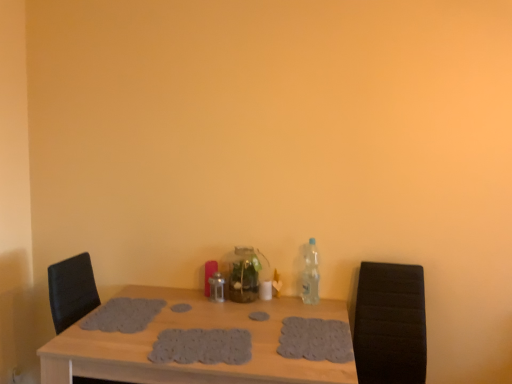
Question: Considering the relative positions of clear glass vase at center, the 1th bottle when ordered from left to right, and gray crocheted placemat at center, the first footprint in the left-to-right sequence, in the image provided, is clear glass vase at center, the 1th bottle when ordered from left to right, to the left or to the right of gray crocheted placemat at center, the first footprint in the left-to-right sequence,?

Choices:
 (A) right
 (B) left

Answer: (A)

Question: Based on their sizes in the image, would you say clear glass vase at center, which is the second bottle from right to left, is bigger or smaller than gray crocheted placemat at center, the first footprint in the left-to-right sequence?

Choices:
 (A) small
 (B) big

Answer: (B)

Question: Based on their relative distances, which object is farther from the black leather armchair at right?

Choices:
 (A) gray textured placemat at center, marked as the fourth footprint in a left-to-right arrangement
 (B) clear plastic bottle at right, the first bottle from the right
 (C) gray crocheted placemat at center, the fourth footprint viewed from the right
 (D) gray knitted placemat at center, positioned as the 2th footprint in left-to-right order
 (E) wooden table at center

Answer: (C)

Question: Which object is the farthest from the clear glass vase at center, which is the second bottle from right to left?

Choices:
 (A) gray fabric placemat at center, which is the 2th footprint in right-to-left order
 (B) gray crocheted placemat at center, the first footprint in the left-to-right sequence
 (C) gray textured placemat at center, marked as the fourth footprint in a left-to-right arrangement
 (D) gray knitted placemat at center, the third footprint viewed from the right
 (E) black leather armchair at right

Answer: (E)